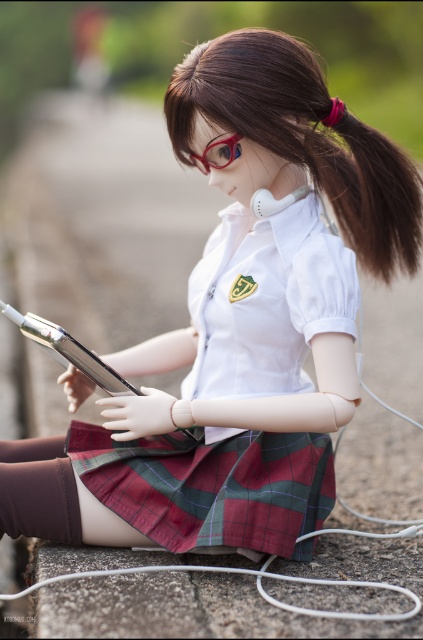
This screenshot has width=423, height=640. What do you see at coordinates (302, 138) in the screenshot? I see `brown silky hair at upper center` at bounding box center [302, 138].

From the picture: Does brown silky hair at upper center appear under brown silky hair at upper right?

No, brown silky hair at upper center is not below brown silky hair at upper right.

Consider the image. Measure the distance between point (225, 122) and camera.

Point (225, 122) and camera are 1.63 meters apart.

Where is `brown silky hair at upper center`? brown silky hair at upper center is located at coordinates (302, 138).

Who is taller, brown silky hair at upper right or translucent blue goggles at center?

With more height is brown silky hair at upper right.

Who is more distant from viewer, (390, 257) or (231, 150)?

The point (390, 257) is more distant.

Where is `brown silky hair at upper right`? The width and height of the screenshot is (423, 640). brown silky hair at upper right is located at coordinates (368, 189).

What do you see at coordinates (302, 138) in the screenshot?
I see `brown silky hair at upper center` at bounding box center [302, 138].

Which is above, brown silky hair at upper center or plaid fabric kilt at center?

brown silky hair at upper center is higher up.

Describe the element at coordinates (302, 138) in the screenshot. I see `brown silky hair at upper center` at that location.

Locate an element on the screen. brown silky hair at upper center is located at coordinates (302, 138).